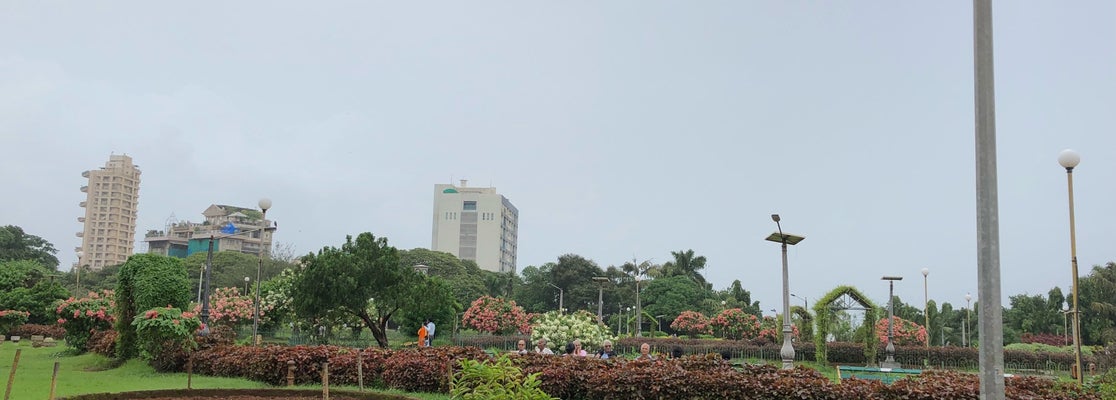
Locate an element on the screen. green plant archway is located at coordinates (831, 290), (817, 337), (869, 312).